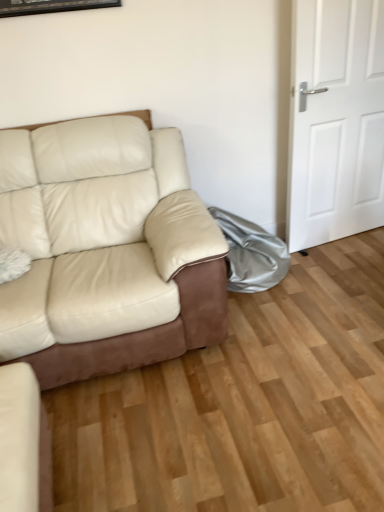
The height and width of the screenshot is (512, 384). Identify the location of free space between beige leather couch at left, marked as the 2th studio couch in a bottom-to-top arrangement, and silver metallic bag at lower right. (266, 308).